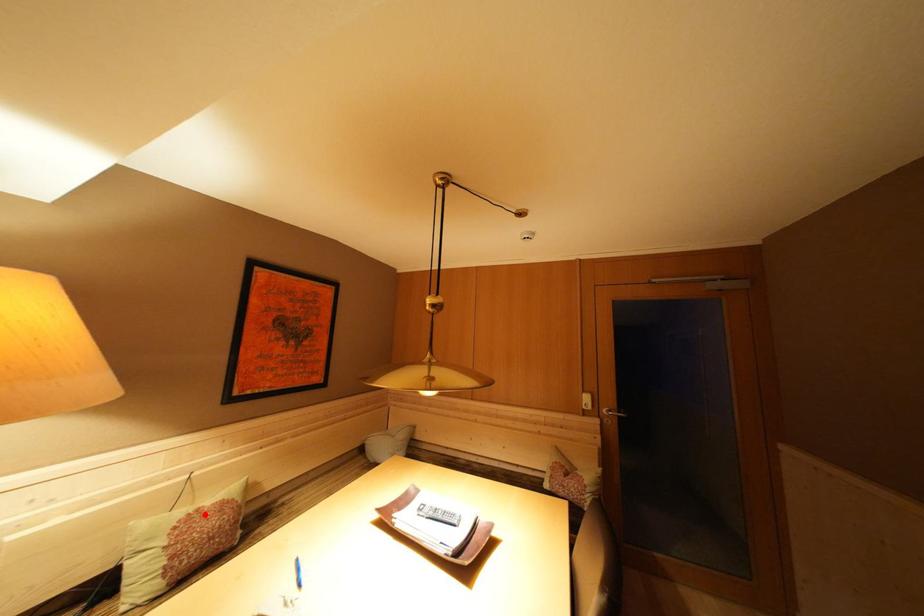
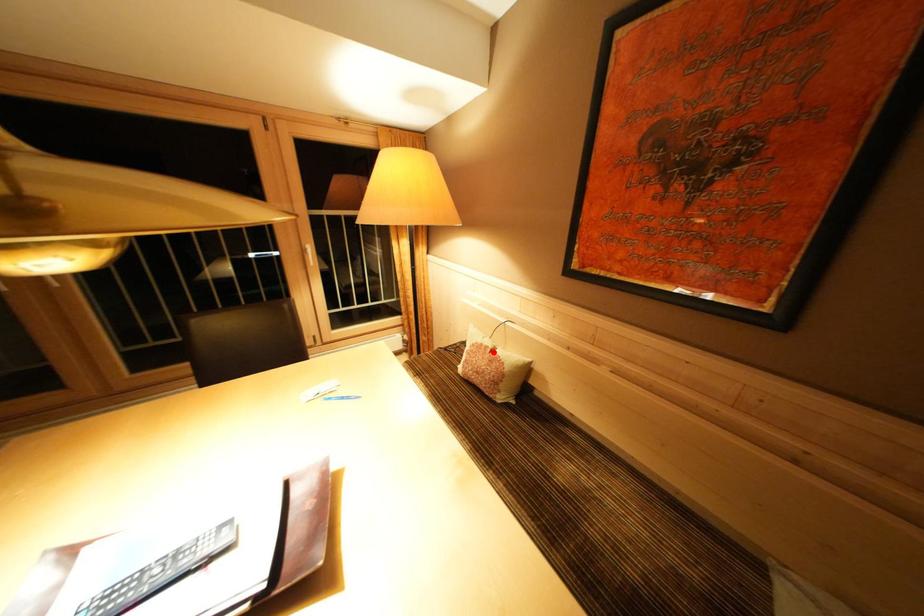
I am providing you with two images of the same scene from different viewpoints. A red point is marked on the first image and another point is marked on the second image. Is the red point in image1 aligned with the point shown in image2?

Yes